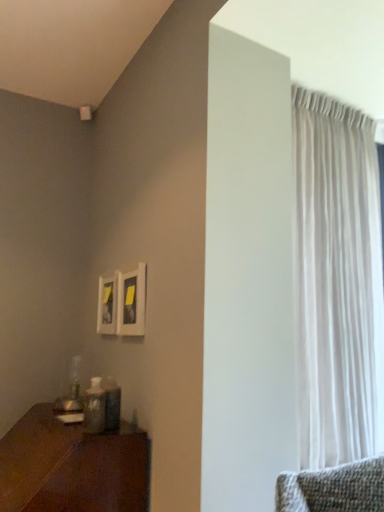
Question: Could you tell me if wooden table at lower left is facing white sheer curtain at right?

Choices:
 (A) yes
 (B) no

Answer: (B)

Question: From the image's perspective, is wooden table at lower left on top of white sheer curtain at right?

Choices:
 (A) yes
 (B) no

Answer: (B)

Question: Can you confirm if wooden table at lower left is positioned to the right of white sheer curtain at right?

Choices:
 (A) no
 (B) yes

Answer: (A)

Question: Is the depth of wooden table at lower left less than that of white sheer curtain at right?

Choices:
 (A) yes
 (B) no

Answer: (A)

Question: From the image's perspective, does wooden table at lower left appear lower than white sheer curtain at right?

Choices:
 (A) yes
 (B) no

Answer: (A)

Question: Is there a large distance between wooden table at lower left and white sheer curtain at right?

Choices:
 (A) yes
 (B) no

Answer: (B)

Question: Considering the relative sizes of white sheer curtain at right and wooden table at lower left in the image provided, is white sheer curtain at right wider than wooden table at lower left?

Choices:
 (A) yes
 (B) no

Answer: (B)

Question: Does white sheer curtain at right have a lesser height compared to wooden table at lower left?

Choices:
 (A) no
 (B) yes

Answer: (A)

Question: Is white sheer curtain at right oriented away from wooden table at lower left?

Choices:
 (A) no
 (B) yes

Answer: (A)

Question: Is white sheer curtain at right taller than wooden table at lower left?

Choices:
 (A) no
 (B) yes

Answer: (B)

Question: Does white sheer curtain at right contain wooden table at lower left?

Choices:
 (A) no
 (B) yes

Answer: (A)

Question: Is white sheer curtain at right aimed at wooden table at lower left?

Choices:
 (A) yes
 (B) no

Answer: (B)

Question: Would you say white sheer curtain at right is inside or outside wooden table at lower left?

Choices:
 (A) inside
 (B) outside

Answer: (B)